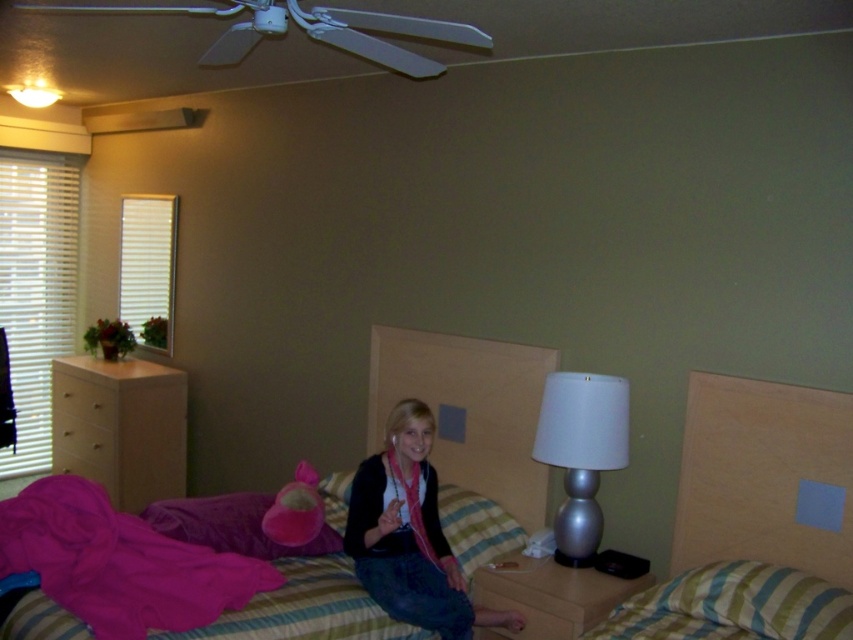
You are standing at the camera position in the bedroom scene. You want to reach the wooden dresser at left without moving your feet. Is it possible?

The wooden dresser at left is 4.30 meters away from camera, so you cannot reach it without moving your feet since it is too far.

You are standing in the bedroom and want to place a new photo frame on the wooden dresser at left. However, the photo frame is too heavy for the silver metallic lamp at right to support. Where should you place the photo frame to ensure it is visible from the bed without obstructing the lamp?

You should place the photo frame on the wooden dresser at left since it is positioned under the silver metallic lamp at right, ensuring visibility from the bed while keeping the lamp unobstructed.